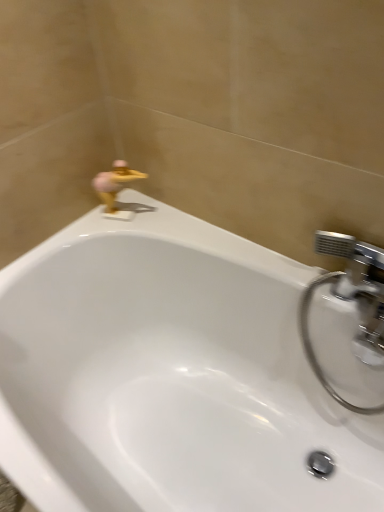
Question: From the image's perspective, is gold metallic duck at upper left located above or below chrome metallic faucet at upper right?

Choices:
 (A) below
 (B) above

Answer: (B)

Question: Looking at their shapes, would you say gold metallic duck at upper left is wider or thinner than chrome metallic faucet at upper right?

Choices:
 (A) wide
 (B) thin

Answer: (B)

Question: Considering the real-world distances, which object is farthest from the gold metallic duck at upper left?

Choices:
 (A) white glossy bathtub at upper center
 (B) chrome metallic faucet at upper right

Answer: (B)

Question: Estimate the real-world distances between objects in this image. Which object is farther from the white glossy bathtub at upper center?

Choices:
 (A) gold metallic duck at upper left
 (B) chrome metallic faucet at upper right

Answer: (A)